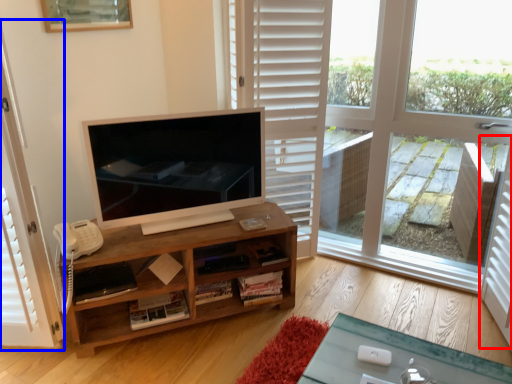
Question: Which object appears farthest to the camera in this image, screen door (highlighted by a red box) or screen door (highlighted by a blue box)?

Choices:
 (A) screen door
 (B) screen door

Answer: (A)